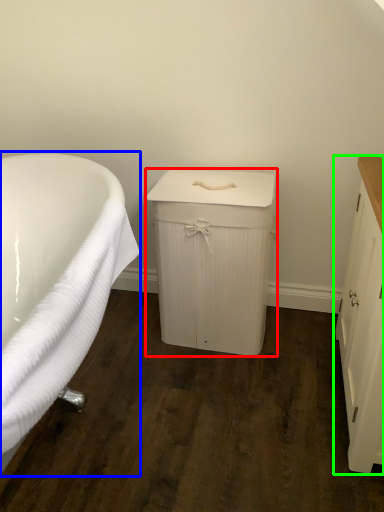
Question: Based on their relative distances, which object is nearer to cabinetry (highlighted by a red box)? Choose from bathtub (highlighted by a blue box) and cabinetry (highlighted by a green box).

Choices:
 (A) bathtub
 (B) cabinetry

Answer: (A)